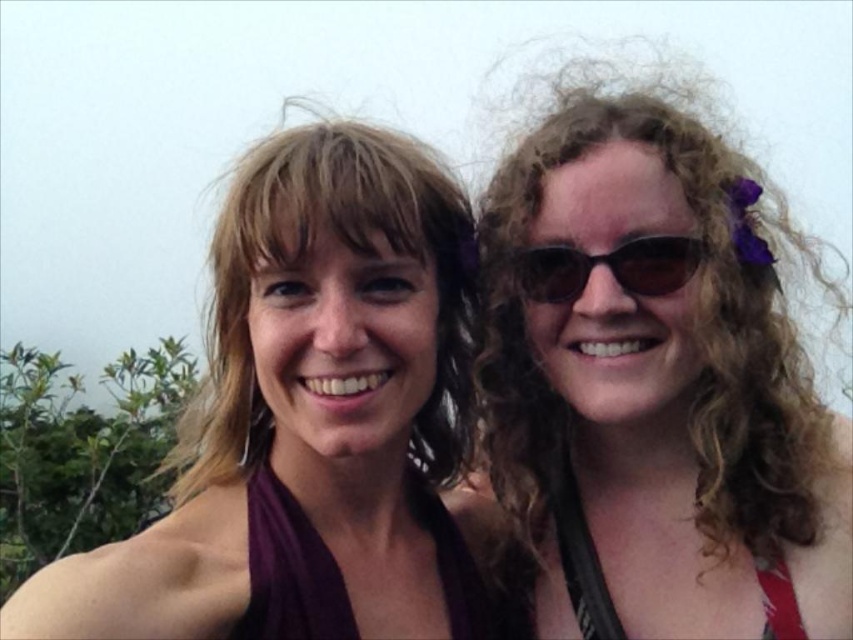
You are a photographer planning to take a photo of the two individuals in the scene. The matte purple dress at center and the purple satin bikini top at center are both visible in the frame. Based on their positions, which one is closer to the camera?

The purple satin bikini top at center is closer to the camera because the matte purple dress at center is positioned under it.

You are a photographer setting up a shoot in a park. You have two outfits to choose from for the model. The first is a matte purple dress at center, and the second is a red fabric bikini top at right. Based on the scene description, which outfit would be more appropriate for a daytime outdoor photoshoot considering the weather and setting?

The matte purple dress at center is taller than the red fabric bikini top at right, so the purple dress would be more appropriate for a daytime outdoor photoshoot in an overcast park setting as it provides more coverage and aligns better with the natural, casual environment.

You are trying to locate the matte purple dress at center in the image. Based on the coordinates provided, can you determine its position relative to the two people?

The matte purple dress at center is located at coordinates point (312, 420), which places it to the right of the person on the left and closer to the person on the right.